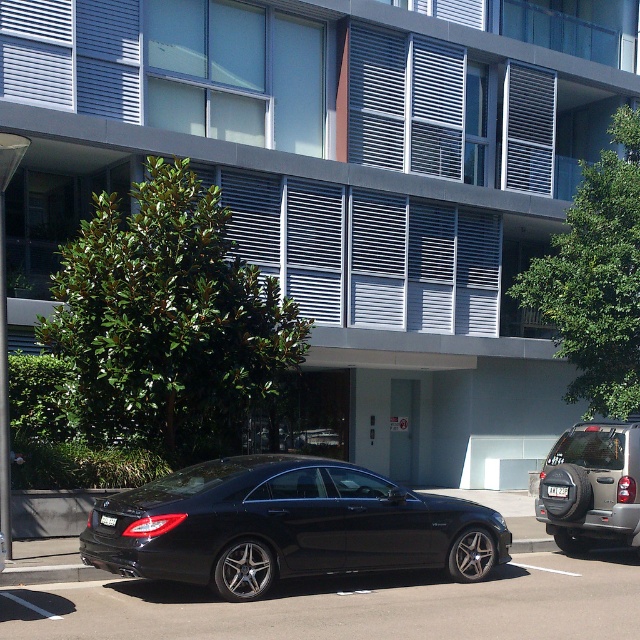
Is glossy black car at center smaller than black metallic car at center?

No, glossy black car at center is not smaller than black metallic car at center.

Who is more forward, (385, 538) or (253, 621)?

Point (253, 621) is in front.

I want to click on glossy black car at center, so click(285, 525).

Does black metallic car at center appear over shiny black sedan at center?

No, black metallic car at center is not above shiny black sedan at center.

Who is positioned more to the left, black metallic car at center or shiny black sedan at center?

black metallic car at center is more to the left.

Between point (397, 600) and point (630, 524), which one is positioned behind?

The point (630, 524) is behind.

Locate an element on the screen. The image size is (640, 640). black metallic car at center is located at coordinates (349, 604).

Is point (116, 500) less distant than point (632, 531)?

Yes, it is in front of point (632, 531).

Does glossy black car at center lie in front of shiny black sedan at center?

Yes, glossy black car at center is in front of shiny black sedan at center.

Is point (404, 531) less distant than point (582, 444)?

Yes.

This screenshot has height=640, width=640. Identify the location of glossy black car at center. tap(285, 525).